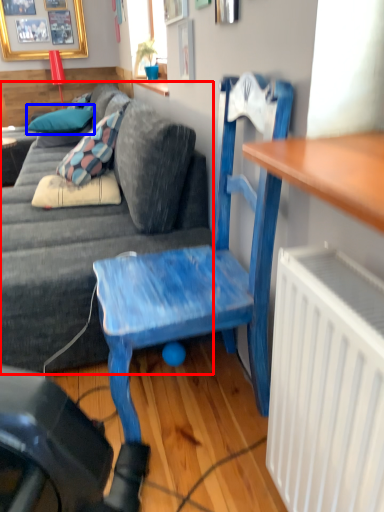
Question: Which object appears farthest to the camera in this image, studio couch (highlighted by a red box) or pillow (highlighted by a blue box)?

Choices:
 (A) studio couch
 (B) pillow

Answer: (B)